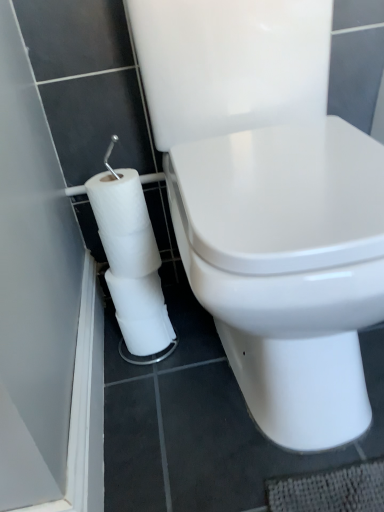
Find the location of a particular element. The width and height of the screenshot is (384, 512). white glossy toilet at center is located at coordinates (269, 204).

Image resolution: width=384 pixels, height=512 pixels. What do you see at coordinates (269, 204) in the screenshot?
I see `white glossy toilet at center` at bounding box center [269, 204].

I want to click on white matte toilet paper at lower left, so click(x=131, y=260).

Describe the element at coordinates (131, 260) in the screenshot. I see `white matte toilet paper at lower left` at that location.

Identify the location of white glossy toilet at center. (269, 204).

Would you say white matte toilet paper at lower left is to the left or to the right of white glossy toilet at center in the picture?

Based on their positions, white matte toilet paper at lower left is located to the left of white glossy toilet at center.

Does white matte toilet paper at lower left come in front of white glossy toilet at center?

No, white matte toilet paper at lower left is further to the viewer.

Is point (168, 343) positioned behind point (327, 32)?

Yes, it is behind point (327, 32).

From the image's perspective, is white matte toilet paper at lower left located beneath white glossy toilet at center?

Yes.

Based on the photo, from a real-world perspective, which object rests below the other?

From a 3D spatial view, white matte toilet paper at lower left is below.

Between white matte toilet paper at lower left and white glossy toilet at center, which one has smaller width?

With smaller width is white matte toilet paper at lower left.

Can you confirm if white matte toilet paper at lower left is shorter than white glossy toilet at center?

Indeed, white matte toilet paper at lower left has a lesser height compared to white glossy toilet at center.

Between white matte toilet paper at lower left and white glossy toilet at center, which one has larger size?

Bigger between the two is white glossy toilet at center.

Which is correct: white matte toilet paper at lower left is inside white glossy toilet at center, or outside of it?

white matte toilet paper at lower left is located beyond the bounds of white glossy toilet at center.

Is white matte toilet paper at lower left with white glossy toilet at center?

No, white matte toilet paper at lower left is not with white glossy toilet at center.

Is white matte toilet paper at lower left positioned with its back to white glossy toilet at center?

No, white glossy toilet at center is not at the back of white matte toilet paper at lower left.

How many degrees apart are the facing directions of white matte toilet paper at lower left and white glossy toilet at center?

The angle between the facing direction of white matte toilet paper at lower left and the facing direction of white glossy toilet at center is 2.62 degrees.

How much distance is there between white matte toilet paper at lower left and white glossy toilet at center?

The distance of white matte toilet paper at lower left from white glossy toilet at center is 10.59 inches.

Where is `toilet in front of the white matte toilet paper at lower left`? The image size is (384, 512). toilet in front of the white matte toilet paper at lower left is located at coordinates (269, 204).

Which is more to the right, white glossy toilet at center or white matte toilet paper at lower left?

Positioned to the right is white glossy toilet at center.

In the image, is white glossy toilet at center positioned in front of or behind white matte toilet paper at lower left?

In the image, white glossy toilet at center appears in front of white matte toilet paper at lower left.

Is point (244, 23) behind point (151, 351)?

No, (244, 23) is closer to viewer.

From the image's perspective, is white glossy toilet at center located above white matte toilet paper at lower left?

Yes.

In the scene shown: From a real-world perspective, is white glossy toilet at center over white matte toilet paper at lower left?

Yes, from a real-world perspective, white glossy toilet at center is above white matte toilet paper at lower left.

Is white glossy toilet at center thinner than white matte toilet paper at lower left?

No.

Considering the sizes of white glossy toilet at center and white matte toilet paper at lower left in the image, is white glossy toilet at center taller or shorter than white matte toilet paper at lower left?

white glossy toilet at center is taller than white matte toilet paper at lower left.

Is white glossy toilet at center bigger than white matte toilet paper at lower left?

Yes, white glossy toilet at center is bigger than white matte toilet paper at lower left.

Is white matte toilet paper at lower left a part of white glossy toilet at center?

No, white matte toilet paper at lower left is not surrounded by white glossy toilet at center.

Is white glossy toilet at center next to white matte toilet paper at lower left and touching it?

No, white glossy toilet at center is not making contact with white matte toilet paper at lower left.

Does white glossy toilet at center turn towards white matte toilet paper at lower left?

No, white glossy toilet at center does not turn towards white matte toilet paper at lower left.

How far apart are white glossy toilet at center and white matte toilet paper at lower left?

white glossy toilet at center and white matte toilet paper at lower left are 10.59 inches apart.

Locate an element on the screen. toilet positioned vertically above the white matte toilet paper at lower left (from a real-world perspective) is located at coordinates (269, 204).

This screenshot has height=512, width=384. I want to click on toilet paper behind the white glossy toilet at center, so click(131, 260).

This screenshot has height=512, width=384. Identify the location of toilet on the right of white matte toilet paper at lower left. (269, 204).